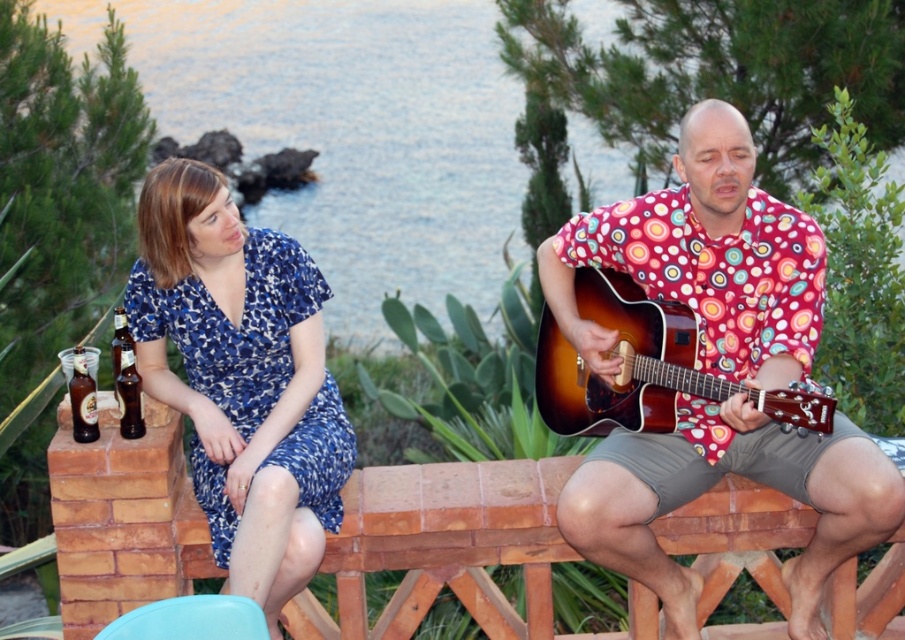
Question: Can you confirm if matte red shirt at center is smaller than brown glass bottle at left?

Choices:
 (A) no
 (B) yes

Answer: (A)

Question: Does matte red shirt at center appear over satin wood guitar at right?

Choices:
 (A) yes
 (B) no

Answer: (B)

Question: Estimate the real-world distances between objects in this image. Which object is farther from the satin wood guitar at right?

Choices:
 (A) matte red shirt at center
 (B) brown glass bottle at left
 (C) blue printed dress at left

Answer: (B)

Question: Is matte red shirt at center below brown glass bottle at left?

Choices:
 (A) no
 (B) yes

Answer: (B)

Question: Based on their relative distances, which object is farther from the blue printed dress at left?

Choices:
 (A) matte red shirt at center
 (B) brown glass bottle at left
 (C) translucent glass bottle at left
 (D) satin wood guitar at right

Answer: (A)

Question: Which object is closer to the camera taking this photo?

Choices:
 (A) satin wood guitar at right
 (B) translucent glass bottle at left
 (C) brown glass bottle at left
 (D) matte red shirt at center

Answer: (A)